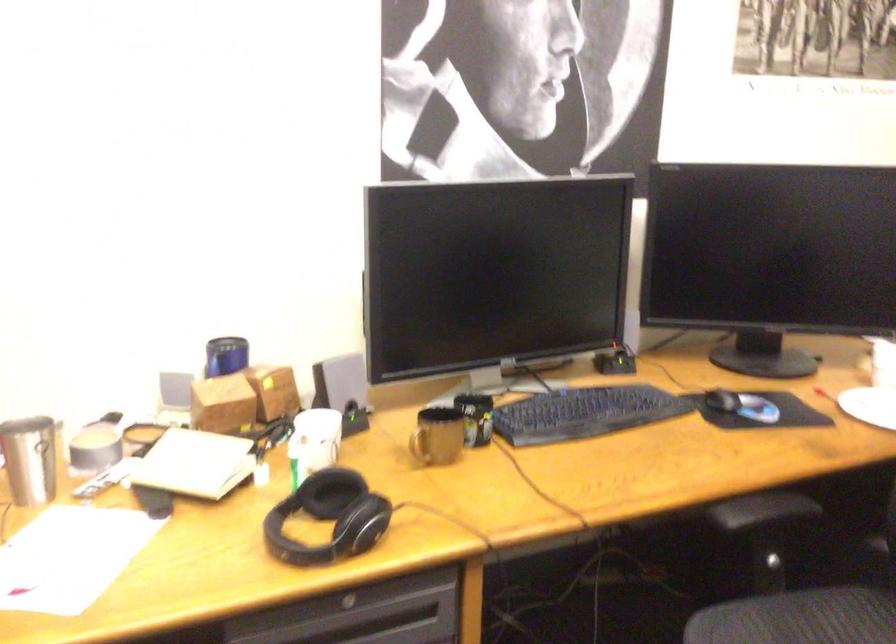
Identify the location of chair armrest. (762, 529).